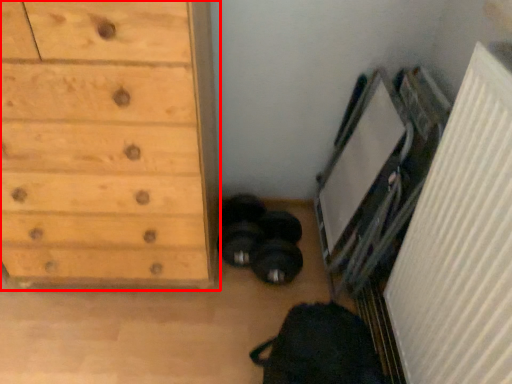
Question: From the image's perspective, where is chest of drawers (annotated by the red box) located in relation to radiator in the image?

Choices:
 (A) above
 (B) below

Answer: (A)